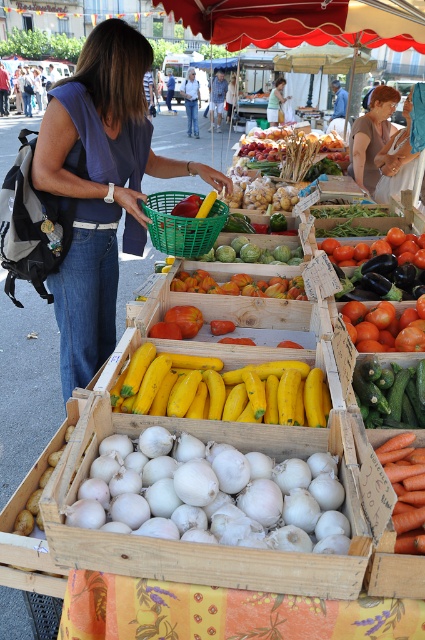
You are a customer at the market and want to place a new item into the green woven basket at center. Where exactly should you place it?

The green woven basket at center is located at coordinates point [181,225], so you should place the new item there.